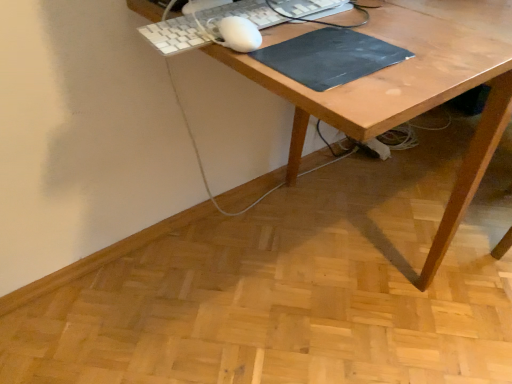
You are a GUI agent. You are given a task and a screenshot of the screen. Output one action in this format:
    pyautogui.click(x=<x>, y=<y>)
    Task: Click on the free space in front of black matte mousepad at center
    The width and height of the screenshot is (512, 384).
    Given the screenshot: What is the action you would take?
    pyautogui.click(x=369, y=92)